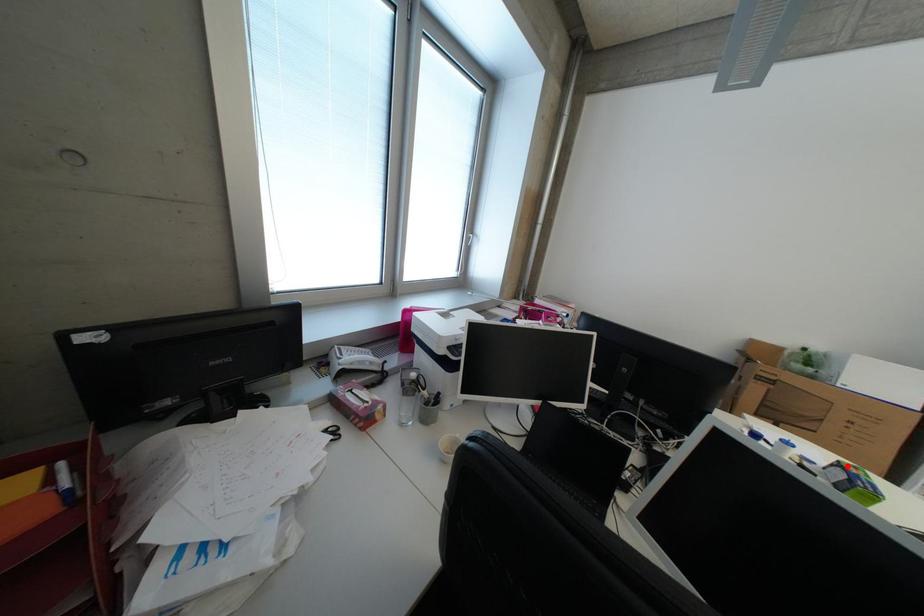
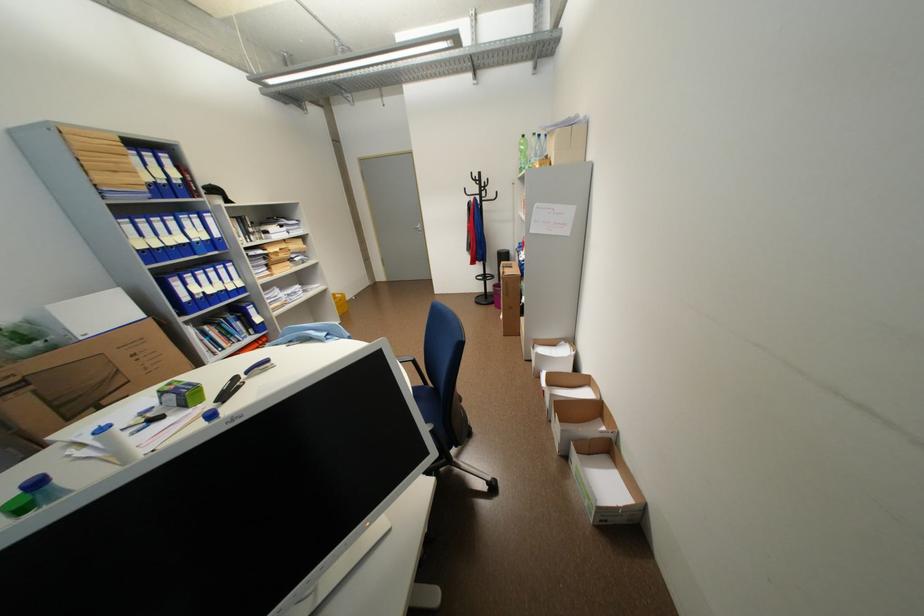
The point at the highlighted location is marked in the first image. Where is the corresponding point in the second image?

(171, 394)